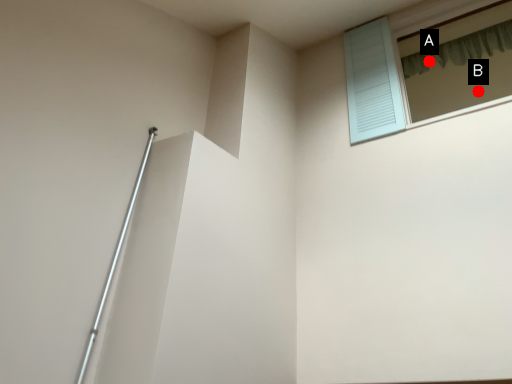
Question: Two points are circled on the image, labeled by A and B beside each circle. Which point is further to the camera?

Choices:
 (A) A is further
 (B) B is further

Answer: (B)